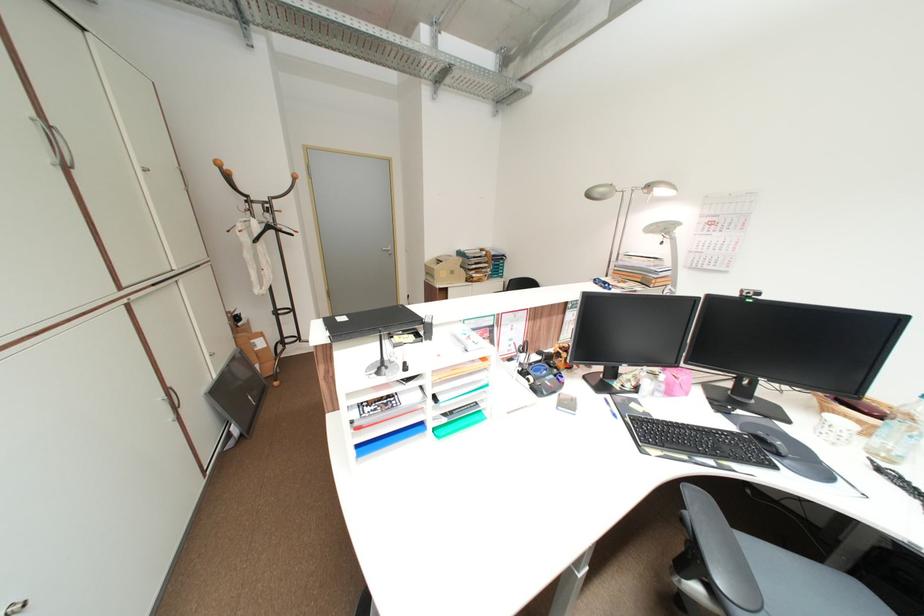
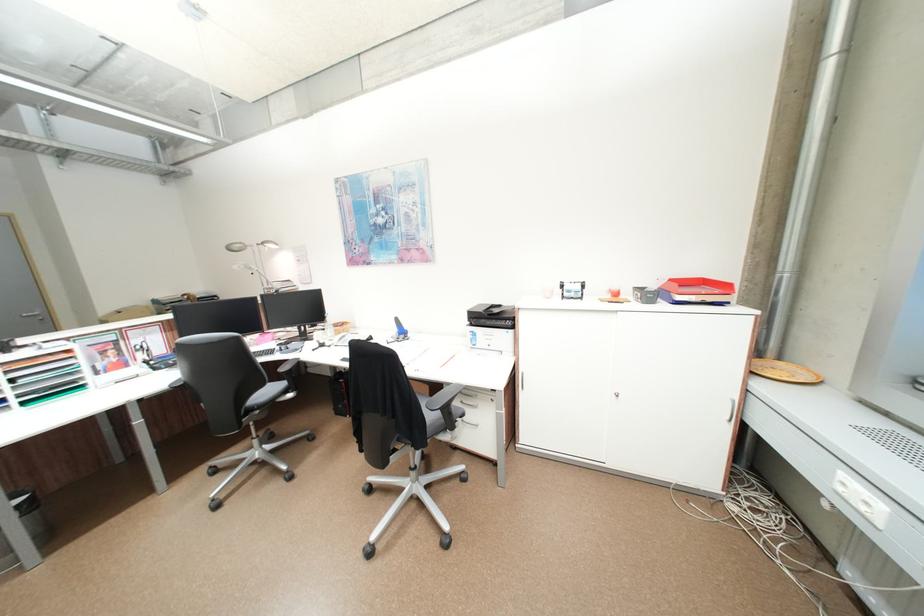
Where in the second image is the point corresponding to (x=606, y=196) from the first image?

(245, 249)